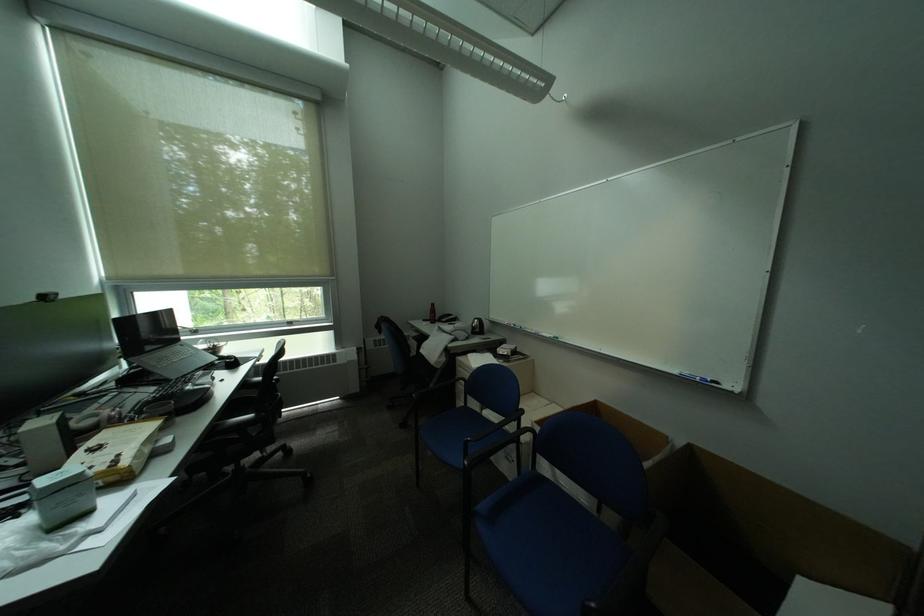
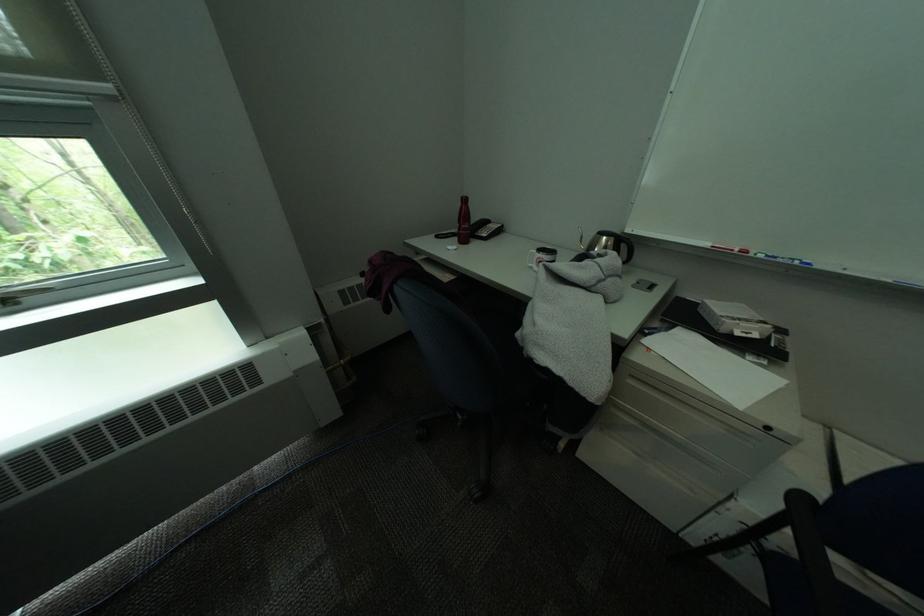
Locate, in the second image, the point that corresponds to [442,317] in the first image.

(475, 228)